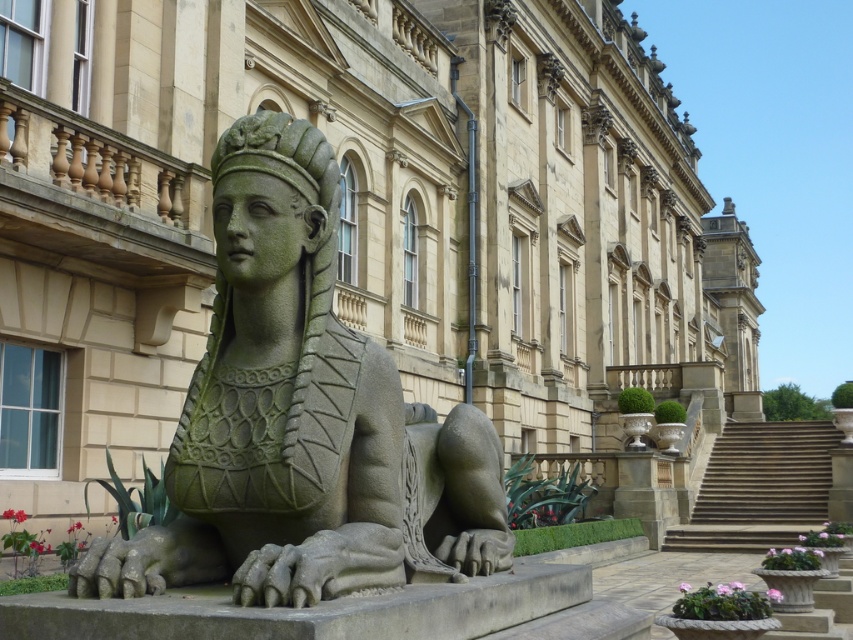
You are a visitor approaching the grand mansion. You see the green stone sphinx at center and the stone stairs at center. Which object is closer to you as you approach the entrance?

The green stone sphinx at center is closer to you because it is positioned over the stone stairs at center, indicating it is in front of the stairs.

From the picture: You are standing in front of the grand mansion and see the point marked at coordinates (302,419). What object is located at that point?

The point at coordinates (302,419) corresponds to the green stone sphinx at center.

You are standing at the entrance of the grand mansion and want to take a photo of the statue of a sphinx. The camera you are using has a focal length of 24mm. To ensure the statue is in focus, you need to know the distance from the camera to the point where the statue is closest. What is the minimum distance you should set your camera focus to, given that the point closest to the camera is at coordinates point [476,506]?

The distance of point [476,506] from the camera is 19.45 meters, so you should set your camera focus to at least 19.45 meters to ensure the statue is in focus.